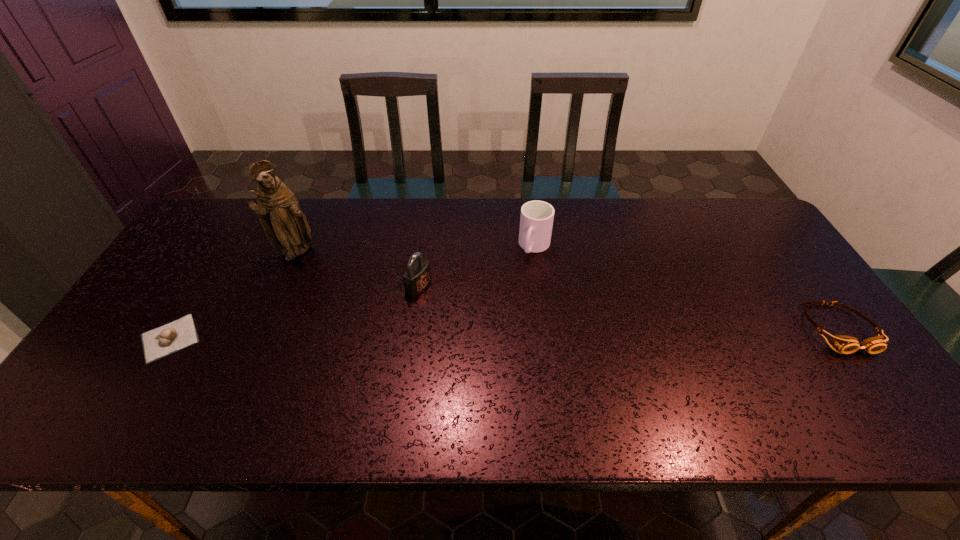
This screenshot has height=540, width=960. I want to click on blank space at the near right corner of the desktop, so click(x=839, y=386).

Locate an element on the screen. The width and height of the screenshot is (960, 540). vacant area between the figurine and the fourth tallest object is located at coordinates (567, 291).

This screenshot has height=540, width=960. Identify the location of free space between the padlock and the figurine. (358, 269).

Where is `vacant area that lies between the cup and the figurine`? Image resolution: width=960 pixels, height=540 pixels. vacant area that lies between the cup and the figurine is located at coordinates (416, 250).

The width and height of the screenshot is (960, 540). In order to click on unoccupied position between the second object from right to left and the third farthest object in this screenshot , I will do `click(477, 267)`.

At what (x,y) coordinates should I click in order to perform the action: click on unoccupied position between the third object from right to left and the rightmost object. Please return your answer as a coordinate pair (x, y). Looking at the image, I should click on (629, 307).

Find the location of a particular element. vacant space in between the third nearest object and the second object from left to right is located at coordinates (358, 269).

Find the location of a particular element. The image size is (960, 540). unoccupied area between the third farthest object and the leftmost object is located at coordinates (295, 312).

This screenshot has height=540, width=960. What are the coordinates of `free space that is in between the garlic and the third farthest object` in the screenshot? It's located at (295, 312).

The height and width of the screenshot is (540, 960). I want to click on free space between the leftmost object and the rightmost object, so click(x=504, y=334).